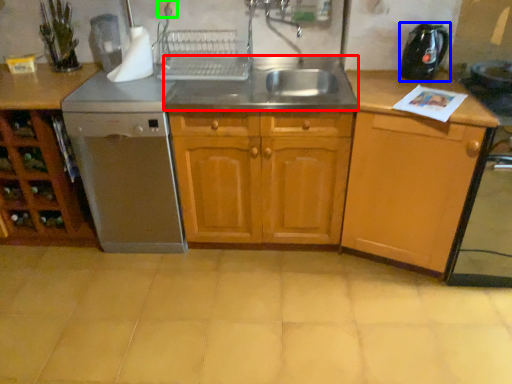
Question: Estimate the real-world distances between objects in this image. Which object is farther from sink (highlighted by a red box), kitchen appliance (highlighted by a blue box) or electric outlet (highlighted by a green box)?

Choices:
 (A) kitchen appliance
 (B) electric outlet

Answer: (B)